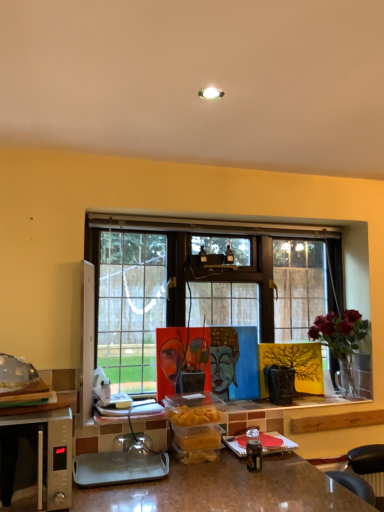
Question: Are deep red flowers in glass vase at right and silver metallic microwave oven at lower left far apart?

Choices:
 (A) yes
 (B) no

Answer: (A)

Question: From a real-world perspective, is deep red flowers in glass vase at right on silver metallic microwave oven at lower left?

Choices:
 (A) yes
 (B) no

Answer: (A)

Question: From the image's perspective, would you say deep red flowers in glass vase at right is positioned over silver metallic microwave oven at lower left?

Choices:
 (A) yes
 (B) no

Answer: (A)

Question: Is deep red flowers in glass vase at right smaller than silver metallic microwave oven at lower left?

Choices:
 (A) no
 (B) yes

Answer: (B)

Question: Is deep red flowers in glass vase at right outside of silver metallic microwave oven at lower left?

Choices:
 (A) no
 (B) yes

Answer: (B)

Question: Is deep red flowers in glass vase at right with silver metallic microwave oven at lower left?

Choices:
 (A) yes
 (B) no

Answer: (B)

Question: Can you confirm if translucent glass food at left is positioned to the left of deep red flowers in glass vase at right?

Choices:
 (A) no
 (B) yes

Answer: (B)

Question: Is translucent glass food at left thinner than deep red flowers in glass vase at right?

Choices:
 (A) no
 (B) yes

Answer: (A)

Question: From a real-world perspective, is translucent glass food at left physically above deep red flowers in glass vase at right?

Choices:
 (A) no
 (B) yes

Answer: (B)

Question: Is the position of translucent glass food at left more distant than that of deep red flowers in glass vase at right?

Choices:
 (A) no
 (B) yes

Answer: (A)

Question: Would you say translucent glass food at left is outside deep red flowers in glass vase at right?

Choices:
 (A) yes
 (B) no

Answer: (A)

Question: Does translucent glass food at left turn towards deep red flowers in glass vase at right?

Choices:
 (A) no
 (B) yes

Answer: (A)

Question: Are deep red flowers in glass vase at right and translucent glass food at left making contact?

Choices:
 (A) yes
 (B) no

Answer: (B)